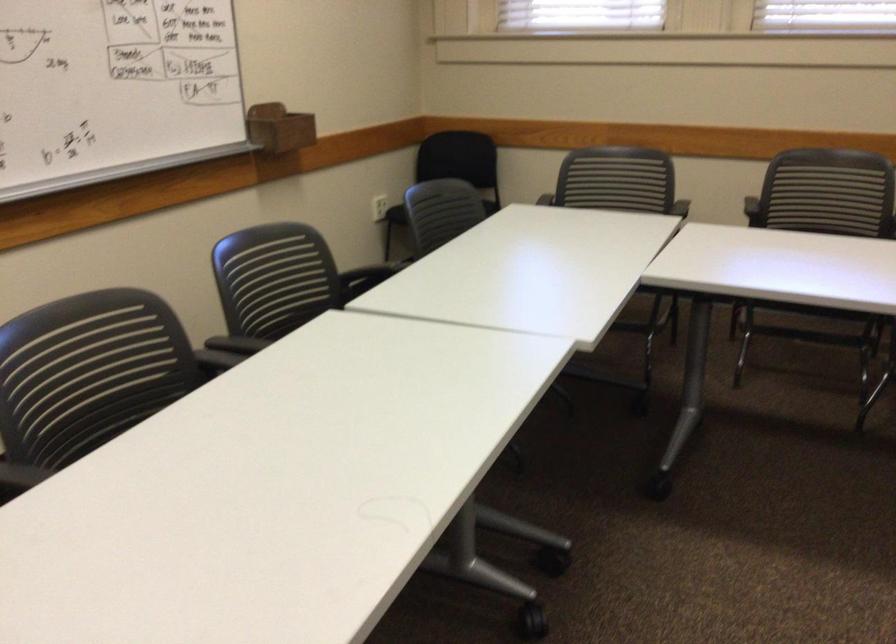
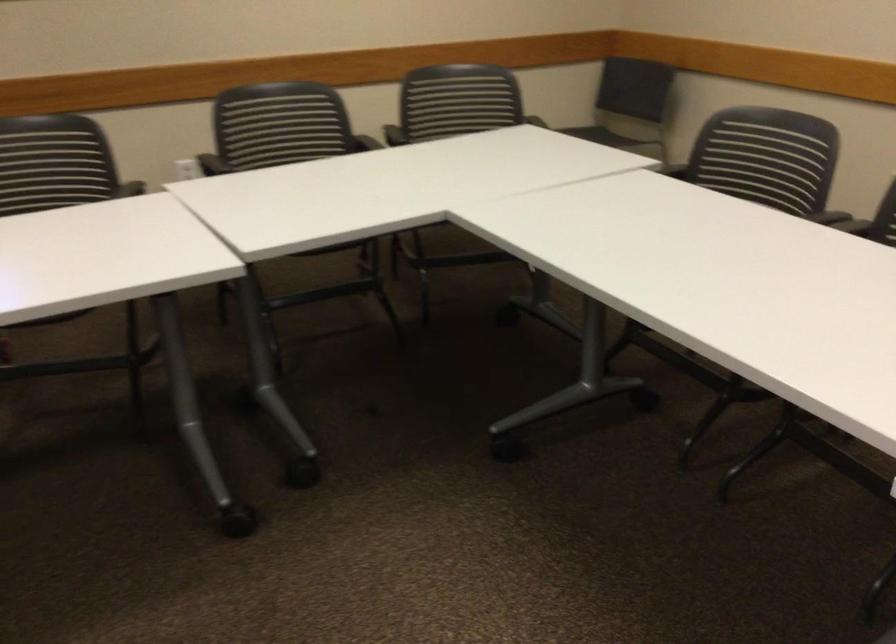
Question: How did the camera likely rotate?

Choices:
 (A) Left
 (B) Right
 (C) Up
 (D) Down

Answer: (B)